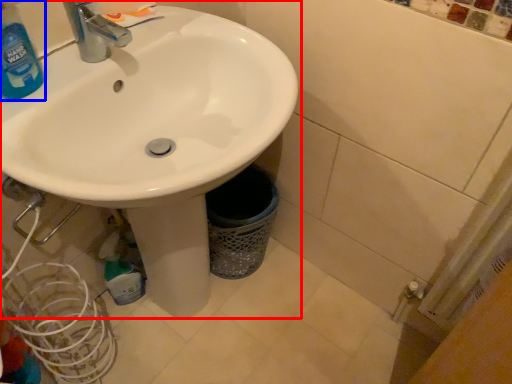
Question: Which of the following is the closest to the observer, sink (highlighted by a red box) or cleaning product (highlighted by a blue box)?

Choices:
 (A) sink
 (B) cleaning product

Answer: (A)